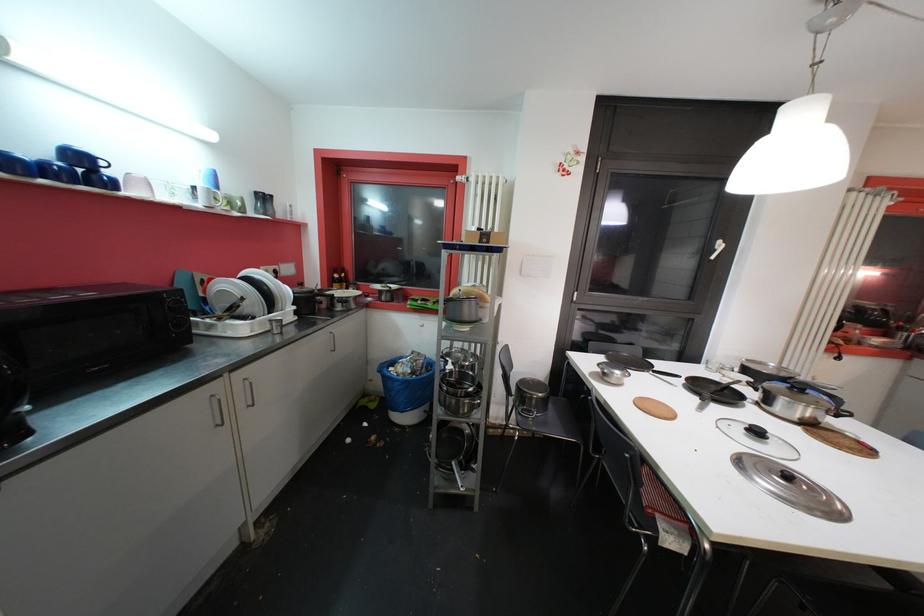
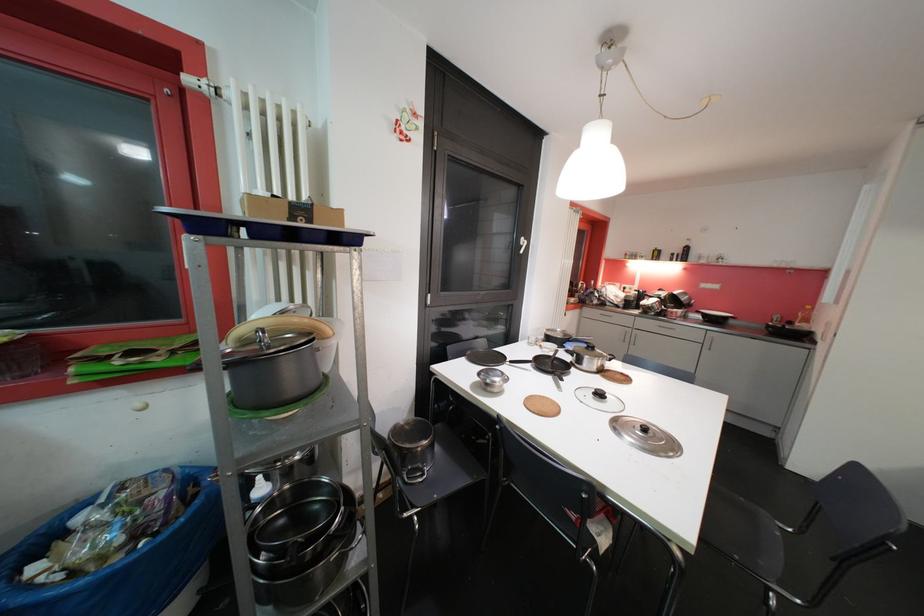
Where in the second image is the point corresponding to point 761,435 from the first image?

(604, 397)